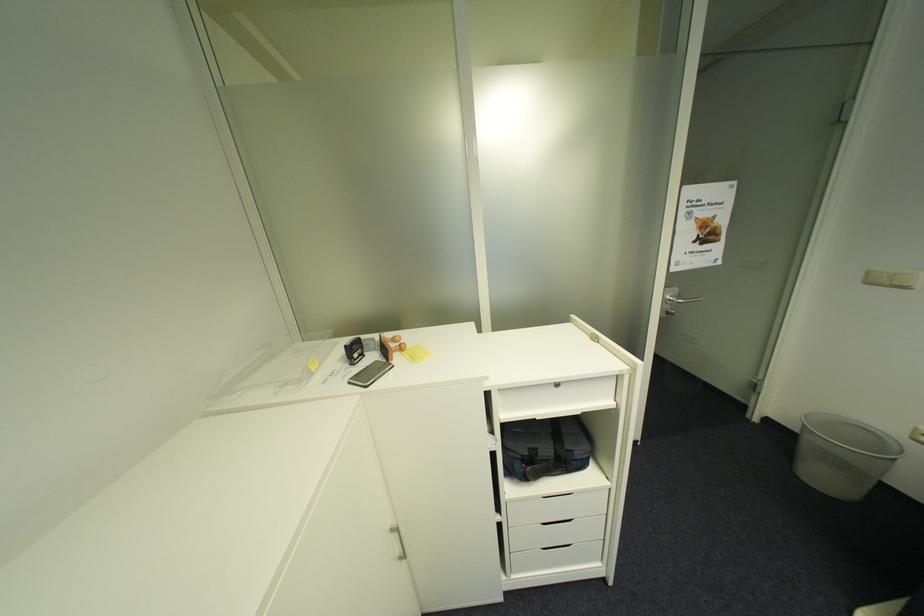
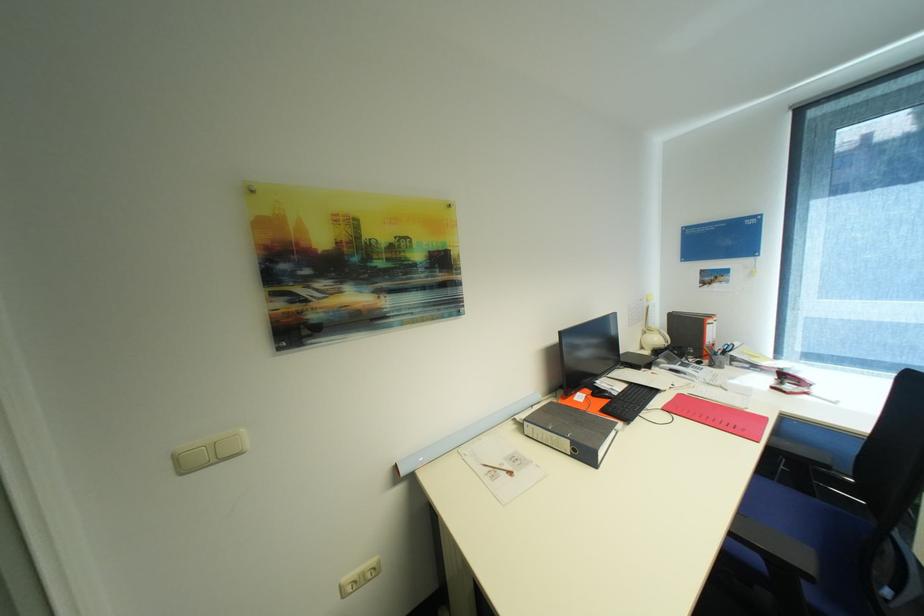
Locate, in the second image, the point that corresponds to (877,274) in the first image.

(185, 458)